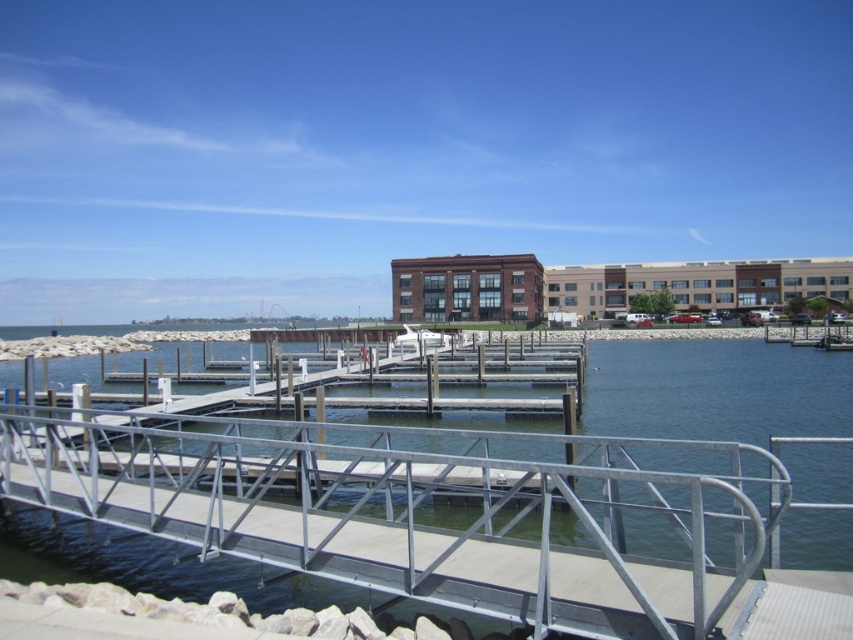
You are standing at the edge of the waterfront scene and want to reach the silver metallic rail at center. Based on its coordinates, can you estimate how far it is from the edge?

The silver metallic rail at center is located at coordinates point (x=424, y=509), so it is approximately 80 meters away from the edge.

You are a photographer standing on the walkway and want to capture both the silver metallic rail at center and the white glossy boat at center in your shot. Which object will appear closer to the top of your photo?

The silver metallic rail at center will appear closer to the top of the photo because it is taller than the white glossy boat at center.

Based on the photo, you are standing at the edge of the water and want to reach the silver metallic rail at center. Given that your maximum reach is 10 feet, can you touch the rail without moving closer?

The distance between you and the silver metallic rail at center is 12.24 feet, which is beyond your 10 feet reach. Therefore, you cannot touch the rail without moving closer.